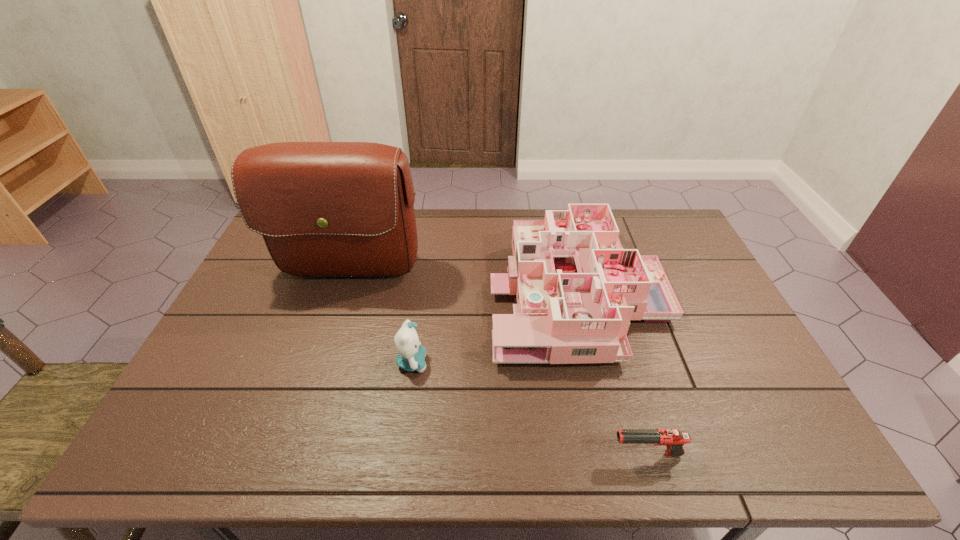
Image resolution: width=960 pixels, height=540 pixels. Identify the location of vacant space that's between the satchel and the shortest object. (498, 365).

Where is `free space between the second tallest object and the shortest object`? free space between the second tallest object and the shortest object is located at coordinates (612, 374).

Where is `free space that is in between the nearest object and the dollhouse`? The height and width of the screenshot is (540, 960). free space that is in between the nearest object and the dollhouse is located at coordinates (612, 374).

The image size is (960, 540). I want to click on unoccupied position between the dollhouse and the tallest object, so click(464, 284).

Locate an element on the screen. The height and width of the screenshot is (540, 960). free space between the shortest object and the tallest object is located at coordinates (498, 365).

Where is `empty space that is in between the second shortest object and the shortest object`? empty space that is in between the second shortest object and the shortest object is located at coordinates (530, 409).

Identify the location of free space between the shortest object and the tallest object. This screenshot has height=540, width=960. (498, 365).

Where is `vacant space that's between the gun and the tallest object`? This screenshot has width=960, height=540. vacant space that's between the gun and the tallest object is located at coordinates (498, 365).

At what (x,y) coordinates should I click in order to perform the action: click on free point between the second shortest object and the shortest object. Please return your answer as a coordinate pair (x, y). The height and width of the screenshot is (540, 960). Looking at the image, I should click on (530, 409).

Identify the location of the third closest object to the shortest object. (325, 209).